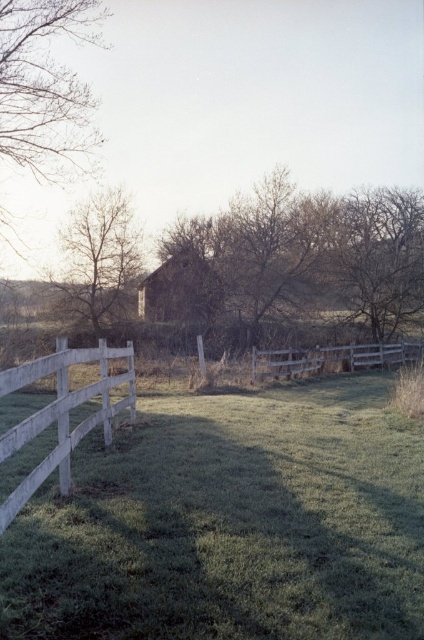
Question: Is brown wood tree at center bigger than bare wood tree at left?

Choices:
 (A) yes
 (B) no

Answer: (A)

Question: Does white wooden fence at left lie behind bare wood tree at left?

Choices:
 (A) yes
 (B) no

Answer: (B)

Question: Which object is closer to the camera taking this photo?

Choices:
 (A) bare branches at left
 (B) brown wood tree at center
 (C) wooden fence at center
 (D) rustic wooden barn at center

Answer: (A)

Question: Can you confirm if brown wood tree at center is positioned to the right of wooden fence at center?

Choices:
 (A) yes
 (B) no

Answer: (A)

Question: Which of these objects is positioned farthest from the rustic wooden barn at center?

Choices:
 (A) wooden fence at center
 (B) bare wood tree at left
 (C) bare branches at left
 (D) brown wood tree at center

Answer: (C)

Question: Which object is closer to the camera taking this photo?

Choices:
 (A) bare branches at left
 (B) brown wood tree at center
 (C) wooden fence at center
 (D) white wooden fence at left

Answer: (D)